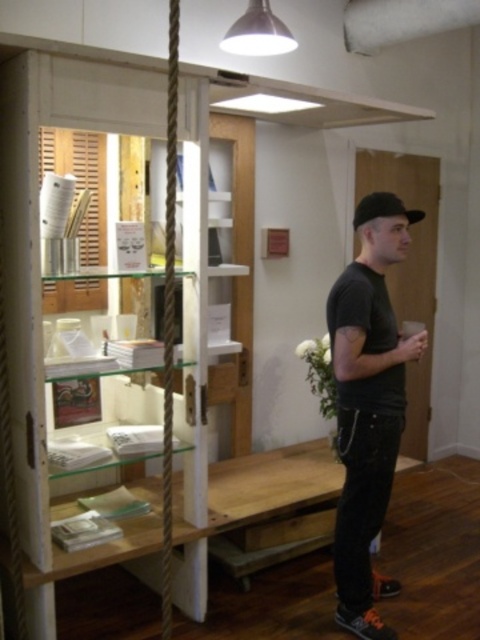
Question: Which point is closer to the camera?

Choices:
 (A) black matte baseball hat at upper right
 (B) clear glass shelves at center

Answer: (B)

Question: Does clear glass shelves at center appear on the right side of black matte t-shirt at center?

Choices:
 (A) yes
 (B) no

Answer: (B)

Question: Can you confirm if clear glass shelves at center is positioned to the left of black matte t-shirt at center?

Choices:
 (A) yes
 (B) no

Answer: (A)

Question: Which object is positioned closest to the metallic silver lampshade at upper center?

Choices:
 (A) black matte baseball hat at upper right
 (B) black matte t-shirt at center

Answer: (A)

Question: Is metallic silver lampshade at upper center behind black matte baseball hat at upper right?

Choices:
 (A) no
 (B) yes

Answer: (B)

Question: Which object is closer to the camera taking this photo?

Choices:
 (A) clear glass shelves at center
 (B) metallic silver lampshade at upper center
 (C) black matte baseball hat at upper right
 (D) black matte t-shirt at center

Answer: (A)